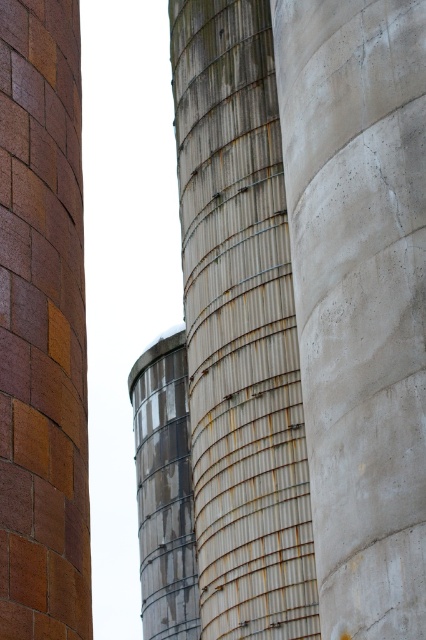
You are an engineer inspecting the site and need to determine which structure is taller between the smooth concrete pillar at center and the rusty metal silo at center. Based on the image, which one is taller?

The rusty metal silo at center is taller than the smooth concrete pillar at center.